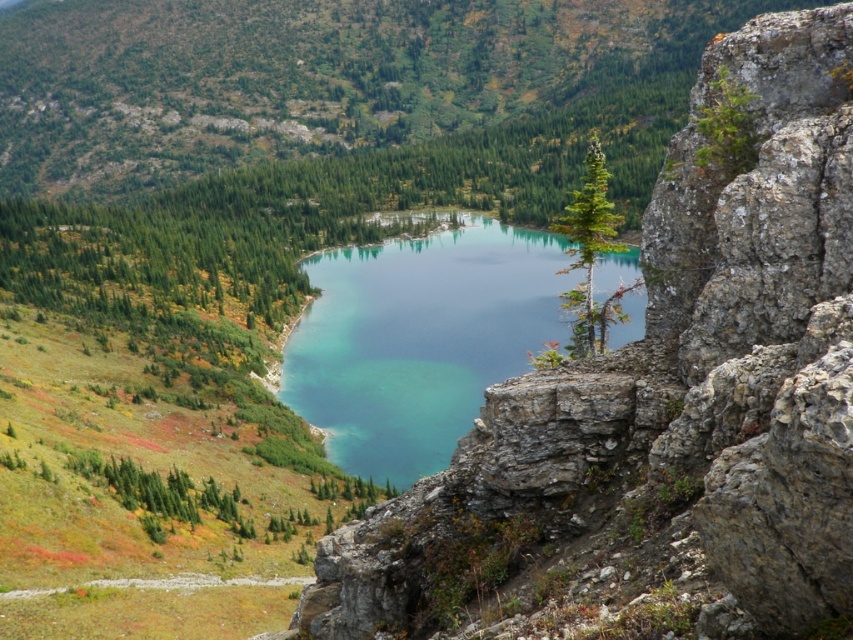
Measure the distance between point [378,518] and camera.

Point [378,518] and camera are 39.71 meters apart.

Is rocky cliff at center to the left of green matte tree at center from the viewer's perspective?

Yes, rocky cliff at center is to the left of green matte tree at center.

Where is `rocky cliff at center`? Image resolution: width=853 pixels, height=640 pixels. rocky cliff at center is located at coordinates (663, 400).

Find the location of a particular element. This screenshot has width=853, height=640. rocky cliff at center is located at coordinates (663, 400).

Is teal glassy water at center smaller than green matte tree at center?

No.

Which is more to the left, teal glassy water at center or green matte tree at center?

teal glassy water at center is more to the left.

Between point (397, 458) and point (579, 291), which one is positioned behind?

Point (397, 458)

The height and width of the screenshot is (640, 853). I want to click on teal glassy water at center, so click(421, 339).

Is rocky cliff at center positioned before teal glassy water at center?

That is True.

Can you confirm if rocky cliff at center is positioned below teal glassy water at center?

Yes, rocky cliff at center is below teal glassy water at center.

Based on the photo, measure the distance between rocky cliff at center and camera.

They are 15.48 meters apart.

The width and height of the screenshot is (853, 640). Find the location of `rocky cliff at center`. rocky cliff at center is located at coordinates (663, 400).